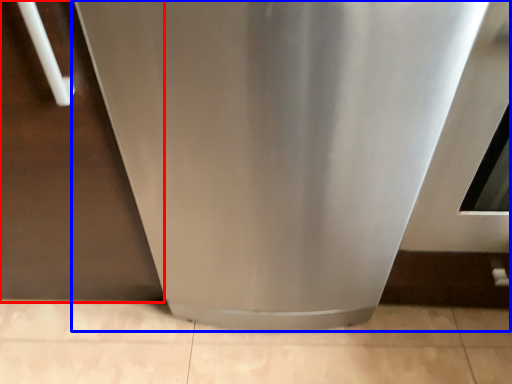
Question: Among these objects, which one is nearest to the camera, door (highlighted by a red box) or home appliance (highlighted by a blue box)?

Choices:
 (A) door
 (B) home appliance

Answer: (B)